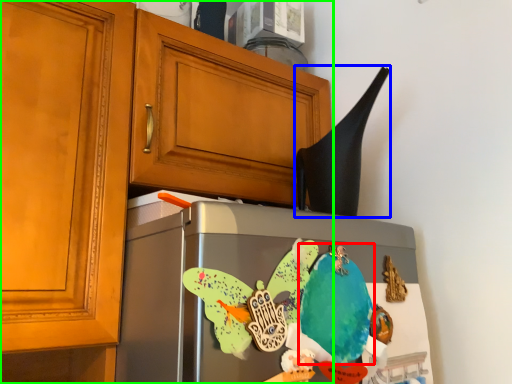
Question: Which object is positioned farthest from parrot (highlighted by a red box)? Select from exhaust hood (highlighted by a blue box) and cabinetry (highlighted by a green box).

Choices:
 (A) exhaust hood
 (B) cabinetry

Answer: (B)